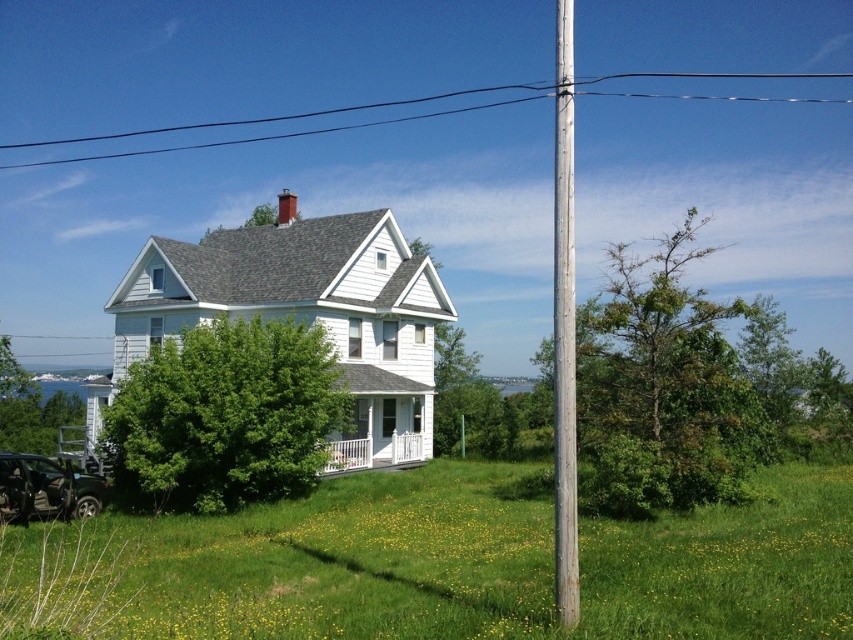
You are planning to install a new satellite dish on the roof of the house. The dish requires a clear path above the metallic black car at lower left and must not interfere with the black wire at upper center. Based on the scene, can the dish be installed without hitting the wire?

The black wire at upper center has a greater height compared to the metallic black car at lower left. Therefore, installing the satellite dish above the metallic black car at lower left would need to ensure it doesn not come into contact with the higher black wire at upper center. Since the wire is taller, the dish must be positioned below the wire to avoid interference.

You are standing at the front door of the two story white house with gray shingled roof. You want to locate the green rough wood pole at right. Where would you look relative to your position?

The green rough wood pole at right is located at the position with coordinates point (663, 387) relative to your position at the front door.